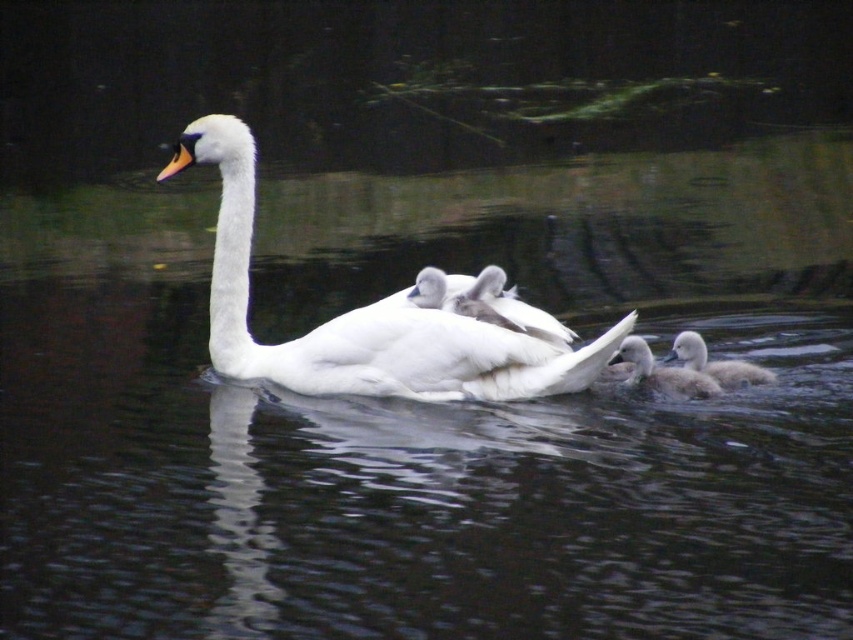
Question: Which object is the farthest from the white fluffy duckling at lower right?

Choices:
 (A) white feathered swan at center
 (B) soft gray downy duckling at lower right
 (C) white fluffy swan at center

Answer: (A)

Question: Which of the following is the closest to the observer?

Choices:
 (A) white fluffy duckling at lower right
 (B) soft gray downy duckling at lower right
 (C) white feathered swan at center
 (D) white fluffy swan at center

Answer: (C)

Question: Which point is farther to the camera?

Choices:
 (A) white fluffy swan at center
 (B) soft gray downy duckling at lower right
 (C) white fluffy duckling at lower right

Answer: (C)

Question: Does white fluffy swan at center appear on the right side of white fluffy duckling at lower right?

Choices:
 (A) no
 (B) yes

Answer: (A)

Question: Is white feathered swan at center closer to the viewer compared to soft gray downy duckling at lower right?

Choices:
 (A) yes
 (B) no

Answer: (A)

Question: Is white fluffy swan at center to the left of white fluffy duckling at lower right from the viewer's perspective?

Choices:
 (A) yes
 (B) no

Answer: (A)